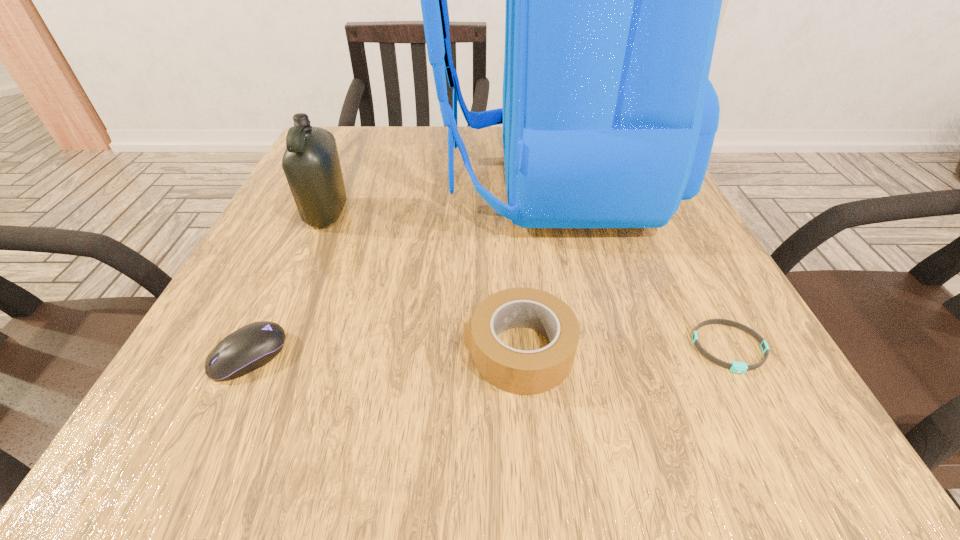
The width and height of the screenshot is (960, 540). Identify the location of free region at the far edge of the desktop. (396, 171).

Find the location of `vacant space at the near edge of the desktop`. vacant space at the near edge of the desktop is located at coordinates (398, 465).

This screenshot has width=960, height=540. I want to click on vacant space at the left edge of the desktop, so click(355, 200).

You are a GUI agent. You are given a task and a screenshot of the screen. Output one action in this format:
    pyautogui.click(x=<x>, y=<y>)
    Task: Click on the vacant position at the right edge of the desktop
    The width and height of the screenshot is (960, 540).
    Given the screenshot: What is the action you would take?
    pyautogui.click(x=673, y=349)

In the image, there is a desktop. Identify the location of vacant space at the far left corner. (349, 151).

The width and height of the screenshot is (960, 540). I want to click on free space at the near left corner of the desktop, so click(291, 409).

This screenshot has width=960, height=540. In the image, there is a desktop. Find the location of `vacant area at the near right corner`. vacant area at the near right corner is located at coordinates (801, 426).

Identify the location of unoccupied area between the fourth tallest object and the third shortest object. (384, 353).

This screenshot has height=540, width=960. I want to click on vacant area that lies between the computer mouse and the second tallest object, so click(x=288, y=285).

Find the location of a particular element. The width and height of the screenshot is (960, 540). vacant space in between the computer mouse and the bottle is located at coordinates (288, 285).